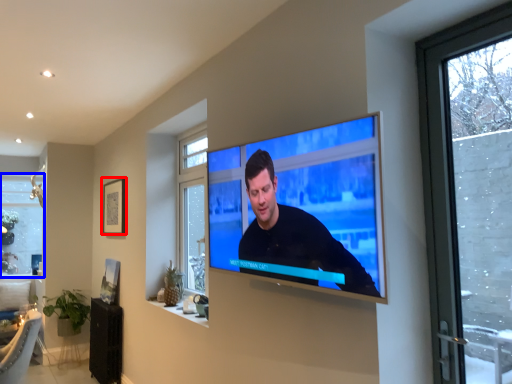
Question: Which object appears closest to the camera in this image, picture frame (highlighted by a red box) or window (highlighted by a blue box)?

Choices:
 (A) picture frame
 (B) window

Answer: (A)